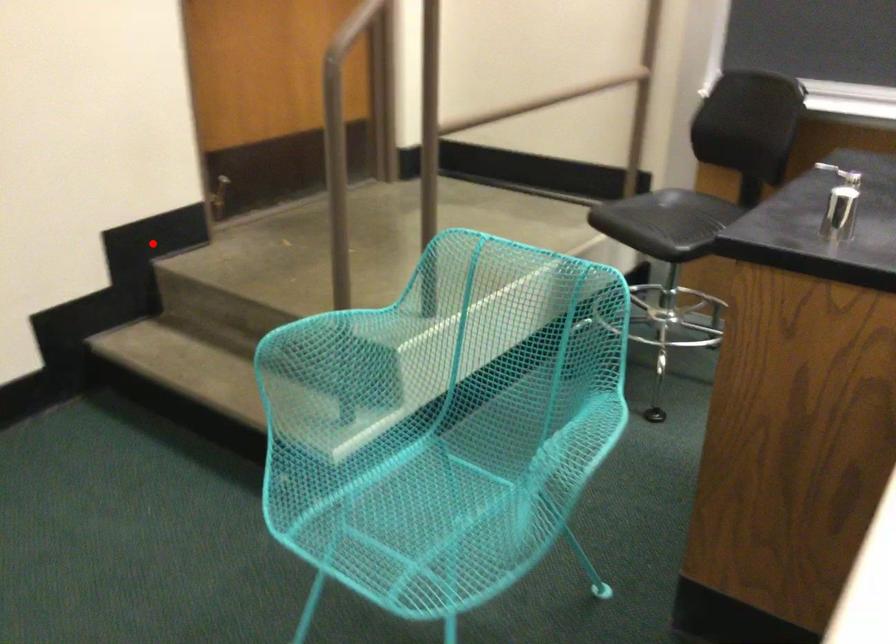
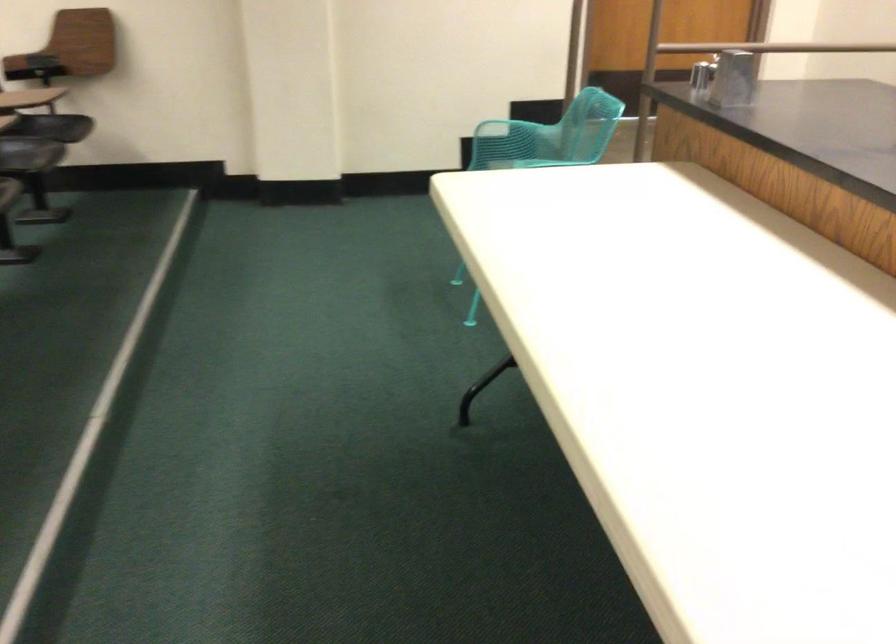
Question: A red point is marked in image1. In image2, is the corresponding 3D point closer to the camera or farther? Reply with the corresponding letter.

Choices:
 (A) The corresponding 3D point is closer.
 (B) The corresponding 3D point is farther.

Answer: (B)